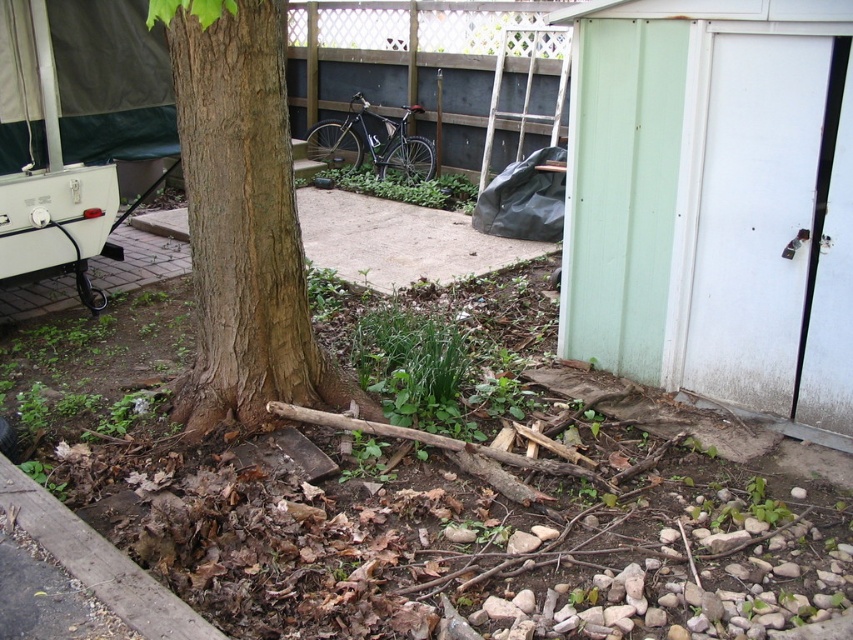
You are standing in the backyard and see the brown rough bark tree at center and the matte black bicycle at center. If you want to move from the tree to the bicycle, which direction should you face?

Since the brown rough bark tree at center is to the left of the matte black bicycle at center, you should face to the right to move from the tree to the bicycle.

You are a painter who wants to paint both the brown rough bark tree at center and the matte black bicycle at center. Since you need to paint the taller object first, which one should you start with?

The brown rough bark tree at center is taller than the matte black bicycle at center, so you should start painting the brown rough bark tree at center first.

You are standing in the backyard and want to place a small potted plant between the two points marked as point (239, 214) and point (407, 170). Which point should the plant be closer to if you want it to be nearer to the viewer?

The plant should be placed closer to point (239, 214) because it is closer to the viewer than point (407, 170).